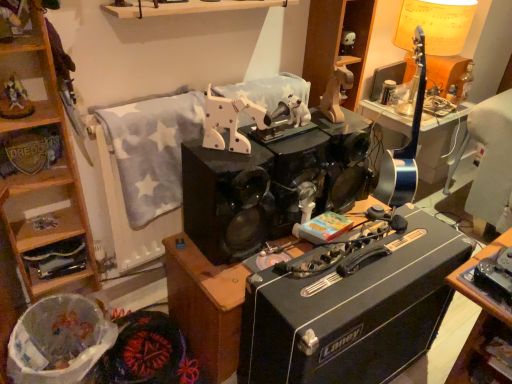
Describe the element at coordinates (56, 260) in the screenshot. Image resolution: width=512 pixels, height=384 pixels. I see `wooden shelf at lower left, which is counted as the second shelf, starting from the left` at that location.

The image size is (512, 384). Identify the location of black glossy stereo at center. (270, 183).

Locate an element on the screen. This screenshot has height=384, width=512. wooden horse at upper center, which appears as the 3th toy when viewed from the front is located at coordinates (336, 94).

From a real-world perspective, is wooden shelf at lower left, arranged as the second shelf when viewed from the right, positioned above or below wooden toy horse at upper left?

Clearly, from a real-world perspective, wooden shelf at lower left, arranged as the second shelf when viewed from the right, is below wooden toy horse at upper left.

Is wooden shelf at lower left, which is counted as the second shelf, starting from the left, at the left side of wooden toy horse at upper left?

Indeed, wooden shelf at lower left, which is counted as the second shelf, starting from the left, is positioned on the left side of wooden toy horse at upper left.

From the image's perspective, is wooden shelf at lower left, the second shelf when ordered from bottom to top, over wooden toy horse at upper left?

Incorrect, from the image's perspective, wooden shelf at lower left, the second shelf when ordered from bottom to top, is lower than wooden toy horse at upper left.

Is wooden shelf at lower left, arranged as the second shelf when viewed from the right, placed right next to wooden toy horse at upper left?

No, wooden shelf at lower left, arranged as the second shelf when viewed from the right, is not beside wooden toy horse at upper left.

From the image's perspective, does wooden toy horse at upper left appear lower than white matte skull at upper center, arranged as the 4th toy when viewed from the left?

Yes.

Would you say wooden toy horse at upper left is inside or outside white matte skull at upper center, the 1th toy positioned from the back?

wooden toy horse at upper left is not enclosed by white matte skull at upper center, the 1th toy positioned from the back.

Is wooden toy horse at upper left turned away from white matte skull at upper center, which ranks as the 1th toy in right-to-left order?

No, wooden toy horse at upper left's orientation is not away from white matte skull at upper center, which ranks as the 1th toy in right-to-left order.

Considering the points (17, 7) and (340, 47), which point is behind, point (17, 7) or point (340, 47)?

The point (340, 47) is farther.

Which of these two, wooden shelf at lower left, arranged as the second shelf when viewed from the right, or wooden horse at upper center, which is the 2th toy in top-to-bottom order, stands shorter?

wooden shelf at lower left, arranged as the second shelf when viewed from the right, is shorter.

Looking at this image, between wooden shelf at lower left, arranged as the second shelf when viewed from the right, and wooden horse at upper center, which is the 2th toy in top-to-bottom order, which one has smaller size?

wooden shelf at lower left, arranged as the second shelf when viewed from the right, is smaller.

Considering their positions, is wooden shelf at lower left, arranged as the second shelf when viewed from the right, located in front of or behind wooden horse at upper center, which is the 2th toy in top-to-bottom order?

wooden shelf at lower left, arranged as the second shelf when viewed from the right, is behind wooden horse at upper center, which is the 2th toy in top-to-bottom order.

From a real-world perspective, relative to wooden horse at upper center, the second toy when ordered from back to front, is wooden shelf at lower left, which is counted as the second shelf, starting from the left, vertically above or below?

wooden shelf at lower left, which is counted as the second shelf, starting from the left, is situated lower than wooden horse at upper center, the second toy when ordered from back to front, in the real world.

Considering the relative sizes of wooden shelf at lower left, which is counted as the second shelf, starting from the left, and metallic silver badge at left, which is the 1th shelf from left to right, in the image provided, is wooden shelf at lower left, which is counted as the second shelf, starting from the left, taller than metallic silver badge at left, which is the 1th shelf from left to right,?

Indeed, wooden shelf at lower left, which is counted as the second shelf, starting from the left, has a greater height compared to metallic silver badge at left, which is the 1th shelf from left to right.

Do you think wooden shelf at lower left, the second shelf when ordered from bottom to top, is within metallic silver badge at left, arranged as the 3th shelf when ordered from the bottom, or outside of it?

wooden shelf at lower left, the second shelf when ordered from bottom to top, is not enclosed by metallic silver badge at left, arranged as the 3th shelf when ordered from the bottom.

Visually, is wooden shelf at lower left, arranged as the second shelf when viewed from the right, positioned to the left or to the right of metallic silver badge at left, arranged as the 3th shelf when ordered from the bottom?

wooden shelf at lower left, arranged as the second shelf when viewed from the right, is positioned on metallic silver badge at left, arranged as the 3th shelf when ordered from the bottom,'s right side.

From a real-world perspective, which object rests below the other?

wooden shelf at lower left, the second shelf when ordered from bottom to top, is physically lower.

From a real-world perspective, which object stands above the other?

wooden horse at upper left, which is the first toy from left to right, from a real-world perspective.

Considering the positions of objects wooden horse at upper left, placed as the fourth toy when sorted from back to front, and white plastic dog at center, placed as the 3th toy when sorted from right to left, in the image provided, who is more to the right, wooden horse at upper left, placed as the fourth toy when sorted from back to front, or white plastic dog at center, placed as the 3th toy when sorted from right to left,?

Positioned to the right is white plastic dog at center, placed as the 3th toy when sorted from right to left.

From the image's perspective, which object appears higher, wooden horse at upper left, marked as the second toy in a bottom-to-top arrangement, or white plastic dog at center, placed as the 3th toy when sorted from back to front?

From the image's view, wooden horse at upper left, marked as the second toy in a bottom-to-top arrangement, is above.

Does wooden horse at upper left, marked as the second toy in a bottom-to-top arrangement, contain white plastic dog at center, acting as the 1th toy starting from the bottom?

No, white plastic dog at center, acting as the 1th toy starting from the bottom, is not surrounded by wooden horse at upper left, marked as the second toy in a bottom-to-top arrangement.

Is wooden horse at upper center, which appears as the 3th toy when viewed from the front, positioned beyond the bounds of wooden horse at upper left, which is the first toy from left to right?

Yes, wooden horse at upper center, which appears as the 3th toy when viewed from the front, is not within wooden horse at upper left, which is the first toy from left to right.

From the image's perspective, relative to wooden horse at upper left, which ranks as the first toy in front-to-back order, is wooden horse at upper center, which appears as the 3th toy when viewed from the front, above or below?

wooden horse at upper center, which appears as the 3th toy when viewed from the front, is situated higher than wooden horse at upper left, which ranks as the first toy in front-to-back order, in the image.

Is wooden horse at upper center, the second toy when ordered from back to front, behind wooden horse at upper left, which is the first toy from left to right?

Yes, wooden horse at upper center, the second toy when ordered from back to front, is behind wooden horse at upper left, which is the first toy from left to right.

Identify the location of the 2nd toy behind the wooden horse at upper left, which is the first toy from left to right, starting your count from the anchor. (336, 94).

Is point (234, 141) closer to camera compared to point (17, 159)?

That is True.

Are white plastic dog at center, placed as the second toy when sorted from front to back, and metallic silver badge at left, the third shelf from the right, far apart?

No, white plastic dog at center, placed as the second toy when sorted from front to back, is in close proximity to metallic silver badge at left, the third shelf from the right.

Is white plastic dog at center, placed as the second toy when sorted from front to back, turned away from metallic silver badge at left, which is the 1th shelf from left to right?

Yes, metallic silver badge at left, which is the 1th shelf from left to right, is at the back of white plastic dog at center, placed as the second toy when sorted from front to back.

Where is `the 3rd shelf behind the wooden toy horse at upper left, starting your count from the anchor`? the 3rd shelf behind the wooden toy horse at upper left, starting your count from the anchor is located at coordinates (56, 260).

Identify the location of person in front of the white matte skull at upper center, placed as the fourth toy when sorted from bottom to top. (14, 19).

When comparing their distances from white plastic dog at center, marked as the 4th toy in a top-to-bottom arrangement, does white plastic trash can at lower left or wooden toy horse at upper left seem closer?

wooden toy horse at upper left.

Looking at the image, which one is located closer to wooden shelf at lower left, the second shelf when ordered from bottom to top, wooden toy horse at upper left or white matte skull at upper center, which ranks as the 1th toy in right-to-left order?

wooden toy horse at upper left lies closer to wooden shelf at lower left, the second shelf when ordered from bottom to top, than the other object.

Considering their positions, is wooden shelf at lower right, which appears as the 1th shelf when viewed from the right, positioned further to white plastic trash can at lower left than matte yellow lampshade at upper right?

Based on the image, matte yellow lampshade at upper right appears to be further to white plastic trash can at lower left.

Which object lies nearer to the anchor point wooden shelf at upper center, the 2th cabinetry positioned from the bottom, wooden horse at upper left, which is the first toy from left to right, or white matte skull at upper center, the 1th toy positioned from the back?

white matte skull at upper center, the 1th toy positioned from the back, lies closer to wooden shelf at upper center, the 2th cabinetry positioned from the bottom, than the other object.

When comparing their distances from wooden shelf at lower left, the 2th shelf in the top-to-bottom sequence, does black plastic amplifier at center or white matte skull at upper center, which is the 4th toy in front-to-back order, seem further?

white matte skull at upper center, which is the 4th toy in front-to-back order, is positioned further to the anchor wooden shelf at lower left, the 2th shelf in the top-to-bottom sequence.

From the image, which object appears to be farther from metallic silver badge at left, the third shelf from the right, white plastic trash can at lower left or wooden shelf at lower left, the 2th shelf in the top-to-bottom sequence?

white plastic trash can at lower left lies further to metallic silver badge at left, the third shelf from the right, than the other object.

Estimate the real-world distances between objects in this image. Which object is further from wooden horse at upper left, which is the first toy from left to right, wooden horse at upper center, which is the 2th toy in top-to-bottom order, or white plastic trash can at lower left?

wooden horse at upper center, which is the 2th toy in top-to-bottom order.

Which object lies further to the anchor point wooden shelf at lower right, which appears as the 3th shelf when viewed from the left, black plastic amplifier at center or wooden toy horse at upper left?

The object further to wooden shelf at lower right, which appears as the 3th shelf when viewed from the left, is wooden toy horse at upper left.

Where is `person situated between wooden horse at upper left, which is the first toy from left to right, and wooden shelf at lower right, which appears as the 1th shelf when viewed from the right, from left to right`? This screenshot has width=512, height=384. person situated between wooden horse at upper left, which is the first toy from left to right, and wooden shelf at lower right, which appears as the 1th shelf when viewed from the right, from left to right is located at coordinates (14, 19).

Locate an element on the screen. The width and height of the screenshot is (512, 384). toy between wooden toy horse at upper left and black glossy stereo at center in the horizontal direction is located at coordinates (230, 121).

This screenshot has height=384, width=512. I want to click on stereo between metallic silver badge at left, which is the 1th shelf from left to right, and wooden shelf at lower right, which is counted as the 3th shelf, starting from the top, in the horizontal direction, so click(x=270, y=183).

You are a GUI agent. You are given a task and a screenshot of the screen. Output one action in this format:
    pyautogui.click(x=<x>, y=<y>)
    Task: Click on the shelf between wooden horse at upper left, which ranks as the first toy in front-to-back order, and matte yellow lampshade at upper right from left to right
    
    Given the screenshot: What is the action you would take?
    pyautogui.click(x=484, y=354)